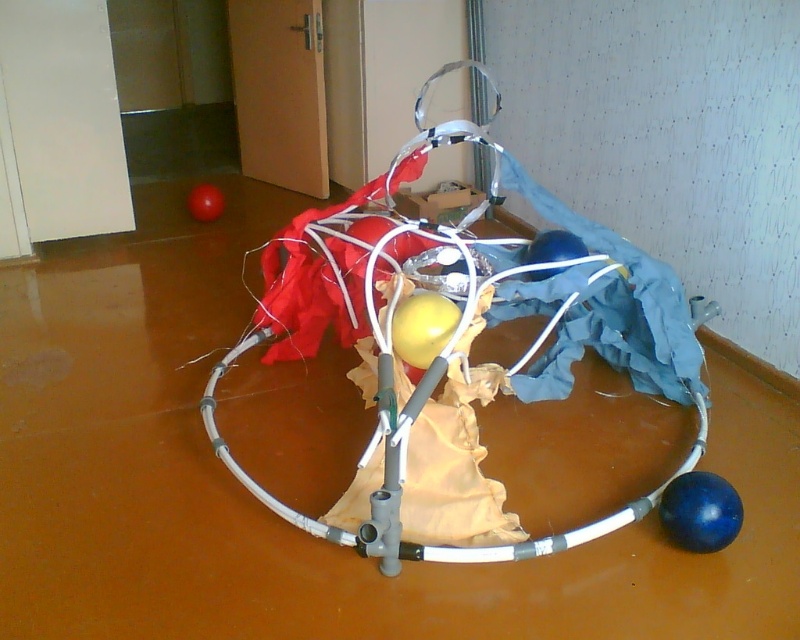
Between metallic wire frame at center and blue rubber ball at lower right, which one has less height?

blue rubber ball at lower right

From the picture: Which is above, metallic wire frame at center or blue rubber ball at lower right?

Positioned higher is metallic wire frame at center.

Is point (574, 356) farther from camera compared to point (694, 518)?

That is True.

The height and width of the screenshot is (640, 800). I want to click on metallic wire frame at center, so click(x=468, y=336).